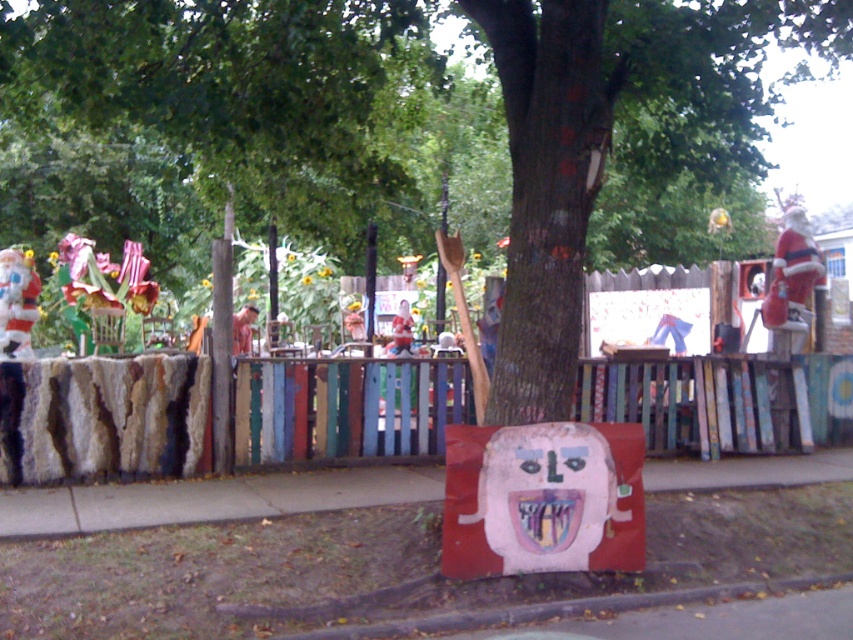
You are standing in the garden and want to walk towards the wooden figure at center. Which direction should you move relative to the smooth concrete sidewalk at center?

You should move to the right of the smooth concrete sidewalk at center to reach the wooden figure at center since the sidewalk is to the left of the wooden figure.

You are a delivery person who needs to place a large package on the smooth concrete sidewalk at center without blocking the matte red santa at center. Given their sizes, is this possible?

The smooth concrete sidewalk at center is smaller than the matte red santa at center. Since the sidewalk is smaller, placing a large package there might not leave enough space for the santa, so it might block it.